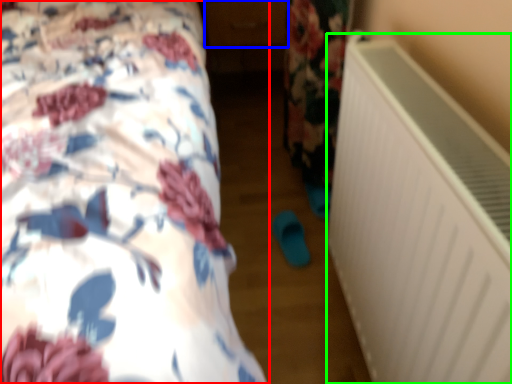
Question: Which object is positioned closest to bed (highlighted by a red box)? Select from drawer (highlighted by a blue box) and air conditioning (highlighted by a green box).

Choices:
 (A) drawer
 (B) air conditioning

Answer: (B)